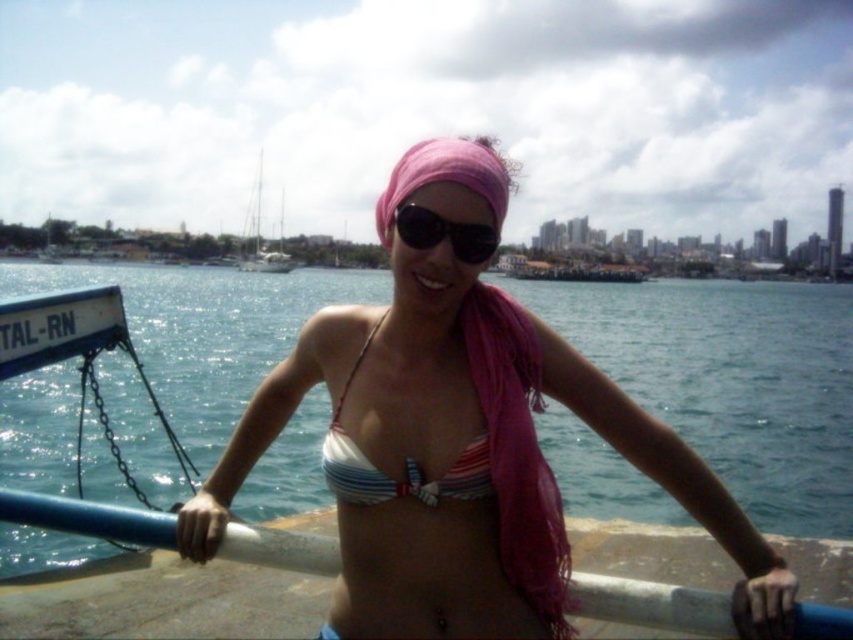
You are a photographer trying to capture the perfect shot of the striped fabric bikini top at center and the black reflective sunglasses at center. Since you want to ensure both are clearly visible, which object should you focus on first considering their sizes?

The striped fabric bikini top at center is shorter than the black reflective sunglasses at center, so you should focus on the black reflective sunglasses at center first since it is larger and more prominent in the frame.

You are a photographer trying to capture the pink fabric headscarf at center and the white matte sailboat at upper center in the same frame. Which object should you focus on first if you want to ensure both are in focus without adjusting the camera settings?

The pink fabric headscarf at center is thinner than the white matte sailboat at upper center, so you should focus on the white matte sailboat at upper center first because it has more depth, making it easier to keep both in focus.